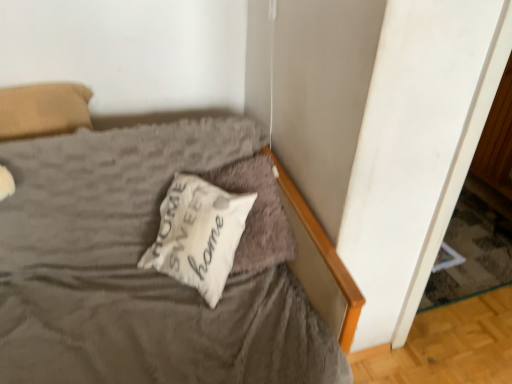
Question: Based on their sizes in the image, would you say white soft pillow at center, placed as the 2th pillow when sorted from left to right, is bigger or smaller than white soft pillow at center, acting as the 1th pillow starting from the left?

Choices:
 (A) small
 (B) big

Answer: (B)

Question: Is white soft pillow at center, placed as the 1th pillow when sorted from right to left, wider or thinner than white soft pillow at center, which is the 2th pillow in right-to-left order?

Choices:
 (A) wide
 (B) thin

Answer: (A)

Question: Is white soft pillow at center, placed as the 2th pillow when sorted from left to right, to the left or to the right of white soft pillow at center, which is the 2th pillow in right-to-left order, in the image?

Choices:
 (A) left
 (B) right

Answer: (B)

Question: Based on their sizes in the image, would you say white soft pillow at center, acting as the 1th pillow starting from the left, is bigger or smaller than white soft pillow at center, placed as the 2th pillow when sorted from left to right?

Choices:
 (A) small
 (B) big

Answer: (A)

Question: From the image's perspective, is white soft pillow at center, which is the 2th pillow in right-to-left order, positioned above or below white soft pillow at center, placed as the 2th pillow when sorted from left to right?

Choices:
 (A) below
 (B) above

Answer: (A)

Question: From a real-world perspective, is white soft pillow at center, acting as the 1th pillow starting from the left, physically located above or below white soft pillow at center, placed as the 1th pillow when sorted from right to left?

Choices:
 (A) below
 (B) above

Answer: (B)

Question: Based on their positions, is white soft pillow at center, which is the 2th pillow in right-to-left order, located to the left or right of white soft pillow at center, placed as the 2th pillow when sorted from left to right?

Choices:
 (A) left
 (B) right

Answer: (A)